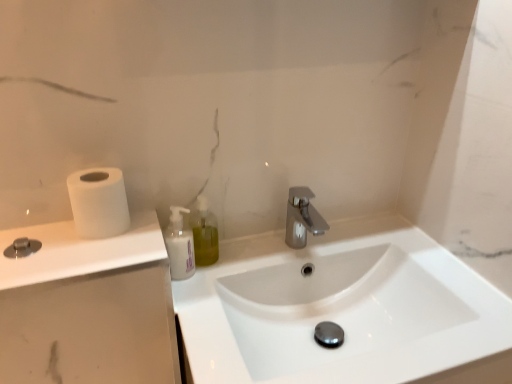
This screenshot has height=384, width=512. What are the coordinates of `vacant area located to the right-hand side of polished chrome faucet at center` in the screenshot? It's located at (378, 240).